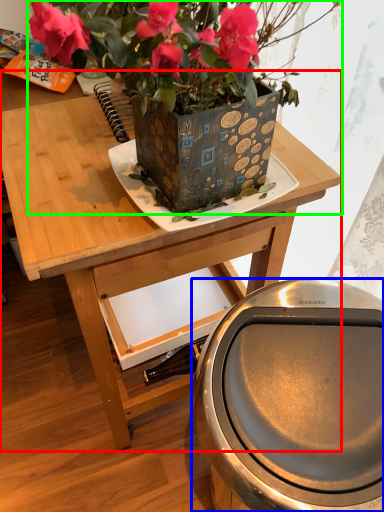
Question: Based on their relative distances, which object is farther from table (highlighted by a red box)? Choose from potty (highlighted by a blue box) and houseplant (highlighted by a green box).

Choices:
 (A) potty
 (B) houseplant

Answer: (A)